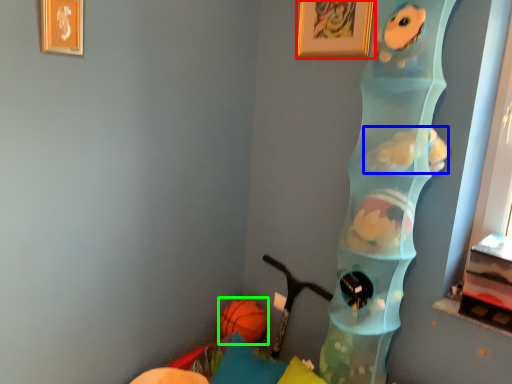
Question: Which is nearer to the picture frame (highlighted by a red box)? animal (highlighted by a blue box) or ball (highlighted by a green box).

Choices:
 (A) animal
 (B) ball

Answer: (A)